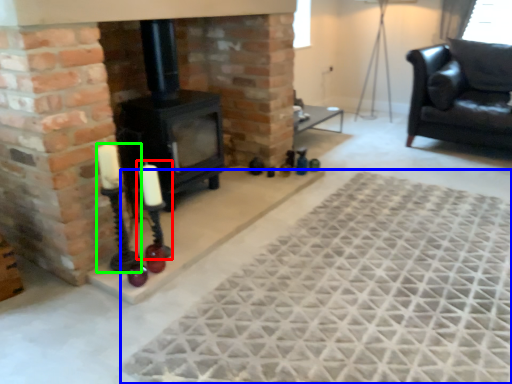
Question: Which object is positioned farthest from candle holder (highlighted by a red box)? Select from mat (highlighted by a blue box) and candle holder (highlighted by a green box).

Choices:
 (A) mat
 (B) candle holder

Answer: (A)